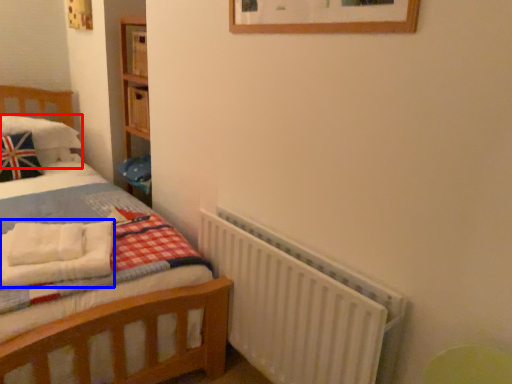
Question: Which of the following is the farthest to the observer, pillow (highlighted by a red box) or blanket (highlighted by a blue box)?

Choices:
 (A) pillow
 (B) blanket

Answer: (A)